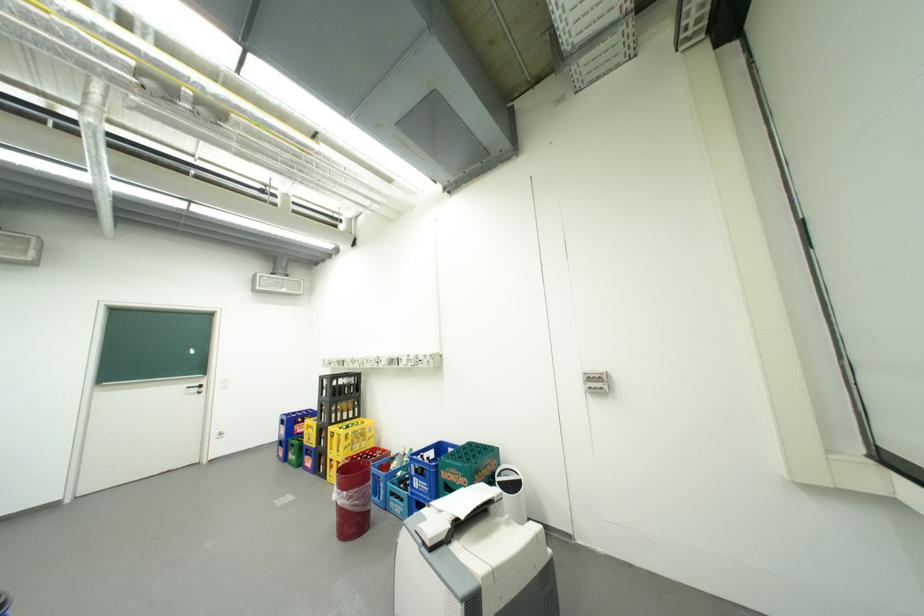
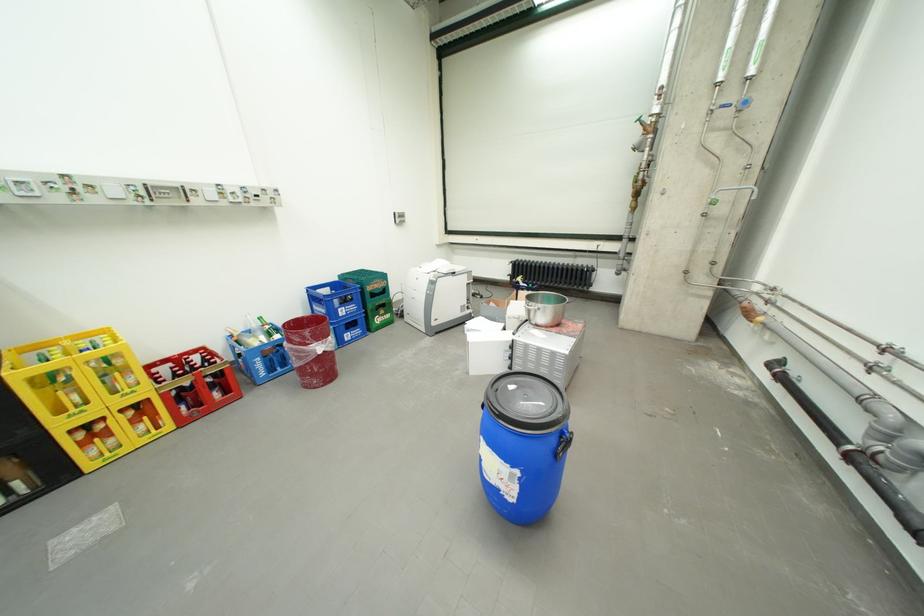
Locate, in the second image, the point that corresponds to (x=371, y=464) in the first image.

(297, 328)